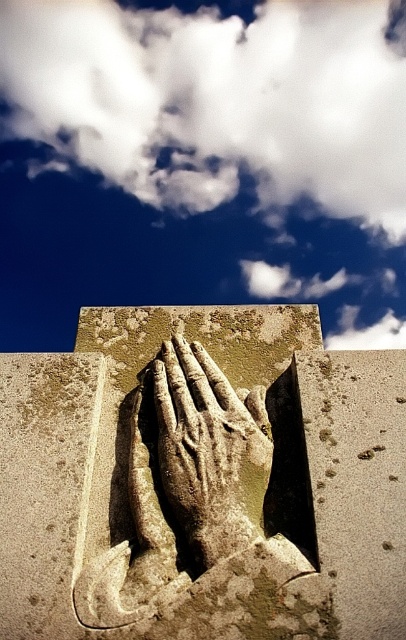
You are an artist standing in front of the sculpture and want to sketch the scene. If you look through your sketchbook, which object would appear closer to you between the white fluffy cloud at upper center and the rough stone hands at center?

The white fluffy cloud at upper center appears closer to you because it is further to the viewer than the rough stone hands at center.

You are an artist trying to sketch the scene. You want to ensure the white fluffy cloud at upper center and the rough stone hands at center are proportionally accurate. Which object should you draw wider?

The white fluffy cloud at upper center should be drawn wider since its width surpasses that of the rough stone hands at center according to the description.

Consider the image. You are an artist trying to sketch the scene. You want to ensure the white fluffy cloud at upper center and the rough stone hand at center are proportionally accurate. Which object should you draw larger?

The white fluffy cloud at upper center should be drawn larger since it is larger than the rough stone hand at center according to the description.